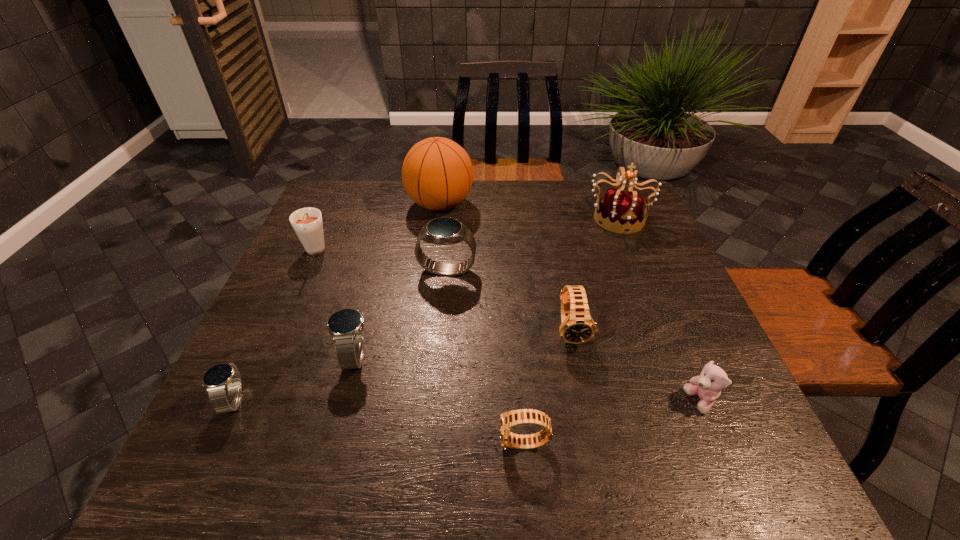
Find the location of a particular element. free space at the far left corner of the desktop is located at coordinates (328, 182).

Identify the location of vacant space at the near right corner. (765, 474).

The width and height of the screenshot is (960, 540). I want to click on free space between the bigger black watch and the orange basketball, so click(x=506, y=268).

Where is `unoccupied position between the tiara and the basketball`? The image size is (960, 540). unoccupied position between the tiara and the basketball is located at coordinates (529, 211).

Image resolution: width=960 pixels, height=540 pixels. I want to click on empty space that is in between the farthest blue watch and the red tiara, so click(x=533, y=244).

Identify the location of empty space between the teddy bear and the second blue watch from right to left. The height and width of the screenshot is (540, 960). (528, 379).

Where is `free space between the orange basketball and the nearest object`? free space between the orange basketball and the nearest object is located at coordinates (482, 325).

The width and height of the screenshot is (960, 540). Identify the location of free space between the second blue watch from right to left and the pink teddy bear. (528, 379).

Where is `vacant space in between the teddy bear and the fourth watch from right to left`? The image size is (960, 540). vacant space in between the teddy bear and the fourth watch from right to left is located at coordinates (528, 379).

You are a GUI agent. You are given a task and a screenshot of the screen. Output one action in this format:
    pyautogui.click(x=<x>, y=<y>)
    Task: Click on the free space between the nearest object and the second blue watch from left to right
    The image size is (960, 540).
    Given the screenshot: What is the action you would take?
    pyautogui.click(x=440, y=400)